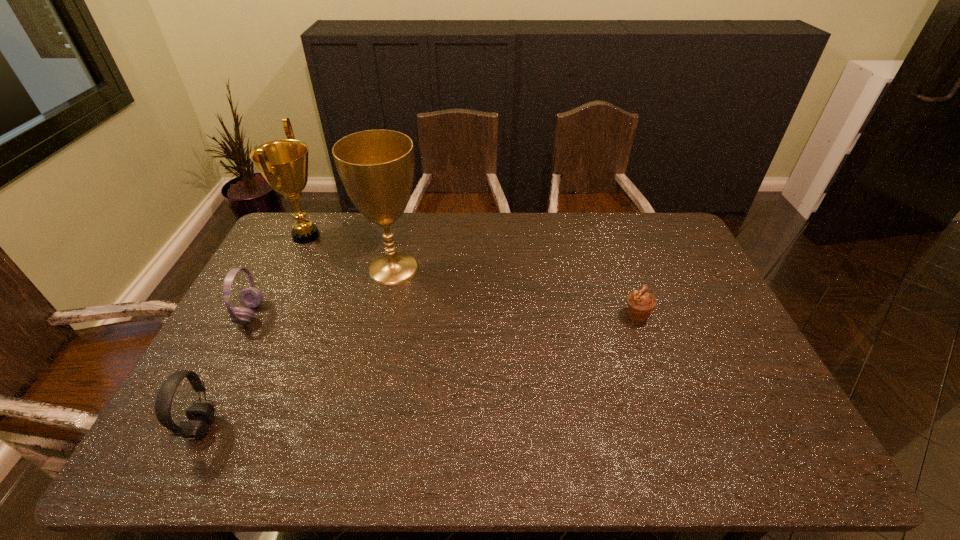
Find the location of a particular element. free space at the right edge of the desktop is located at coordinates (701, 311).

This screenshot has width=960, height=540. I want to click on blank space at the near left corner of the desktop, so click(x=164, y=452).

You are a GUI agent. You are given a task and a screenshot of the screen. Output one action in this format:
    pyautogui.click(x=<x>, y=<y>)
    Task: Click on the free space between the rightmost object and the nearest object
    
    Given the screenshot: What is the action you would take?
    pyautogui.click(x=420, y=371)

At what (x,y) coordinates should I click in order to perform the action: click on vacant area that lies between the nearest object and the shortest object. Please return your answer as a coordinate pair (x, y). Image resolution: width=960 pixels, height=540 pixels. Looking at the image, I should click on (420, 371).

Where is `empty space that is in between the award and the farther headset`? empty space that is in between the award and the farther headset is located at coordinates (278, 275).

At what (x,y) coordinates should I click in order to perform the action: click on unoccupied area between the muffin and the trophy cup. Please return your answer as a coordinate pair (x, y). Image resolution: width=960 pixels, height=540 pixels. Looking at the image, I should click on (516, 292).

Locate an element on the screen. Image resolution: width=960 pixels, height=540 pixels. free spot between the award and the muffin is located at coordinates (471, 275).

Image resolution: width=960 pixels, height=540 pixels. Identify the location of free space between the farther headset and the nearest object. (227, 370).

Identify the location of vacant area that lies between the farther headset and the shortest object. (444, 314).

At what (x,y) coordinates should I click in order to perform the action: click on vacant space that is in between the award and the farther headset. Please return your answer as a coordinate pair (x, y). This screenshot has height=540, width=960. Looking at the image, I should click on (278, 275).